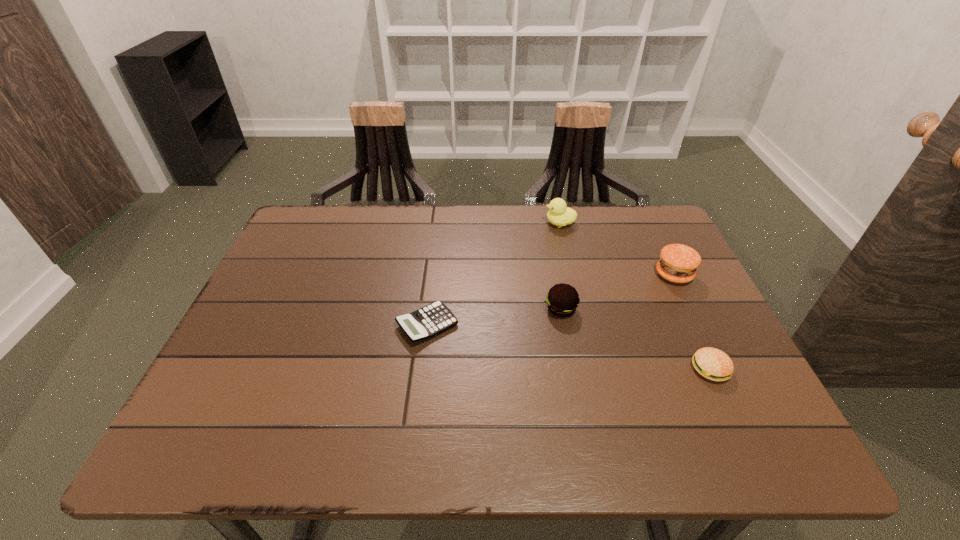
At what (x,y) coordinates should I click in order to perform the action: click on vacant area at the right edge of the desktop. Please return your answer as a coordinate pair (x, y). Looking at the image, I should click on (732, 356).

In the image, there is a desktop. At what (x,y) coordinates should I click in order to perform the action: click on vacant space at the far left corner. Please return your answer as a coordinate pair (x, y). The height and width of the screenshot is (540, 960). Looking at the image, I should click on (310, 212).

You are a GUI agent. You are given a task and a screenshot of the screen. Output one action in this format:
    pyautogui.click(x=<x>, y=<y>)
    Task: Click on the vacant point at the far right corner
    Image resolution: width=960 pixels, height=540 pixels.
    Given the screenshot: What is the action you would take?
    (x=622, y=207)

At what (x,y) coordinates should I click in order to perform the action: click on unoccupied area between the calculator and the second shortest object. Please return your answer as a coordinate pair (x, y). Looking at the image, I should click on (568, 347).

At what (x,y) coordinates should I click in order to perform the action: click on free space between the duckling and the calculator. Please return your answer as a coordinate pair (x, y). Looking at the image, I should click on coord(493,274).

Locate an element on the screen. This screenshot has width=960, height=540. unoccupied area between the duckling and the farthest patty is located at coordinates (617, 249).

The height and width of the screenshot is (540, 960). What are the coordinates of `vacant space in between the leftmost patty and the calculator` in the screenshot? It's located at (494, 317).

The height and width of the screenshot is (540, 960). Identify the location of free spot between the second farthest object and the second farthest patty. (617, 292).

This screenshot has width=960, height=540. I want to click on empty space between the calculator and the farthest object, so click(x=493, y=274).

Where is `vacant area that lies between the leftmost patty and the shortest object`? The image size is (960, 540). vacant area that lies between the leftmost patty and the shortest object is located at coordinates (494, 317).